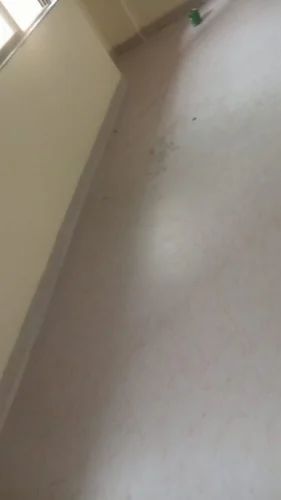
Locate an element on the screen. bucket is located at coordinates (195, 12).